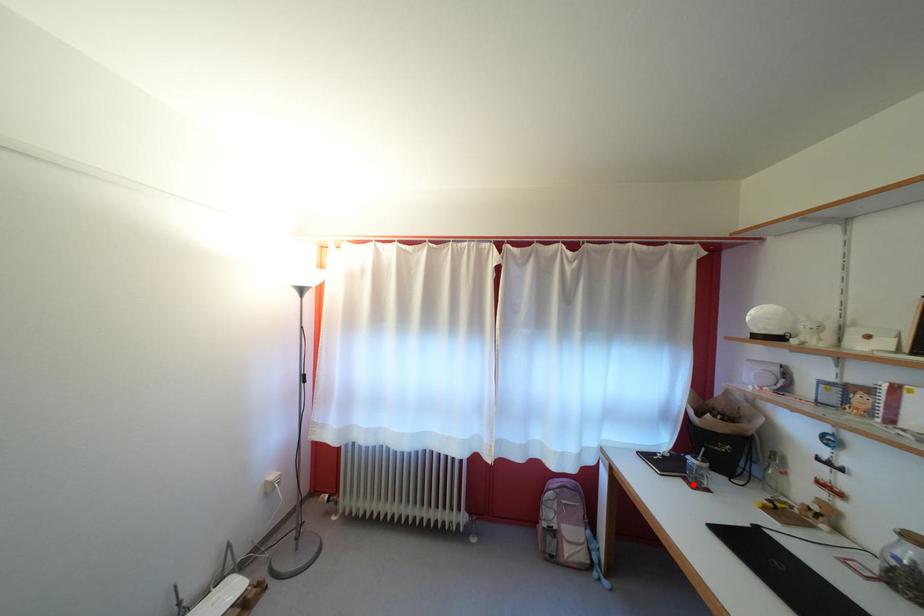
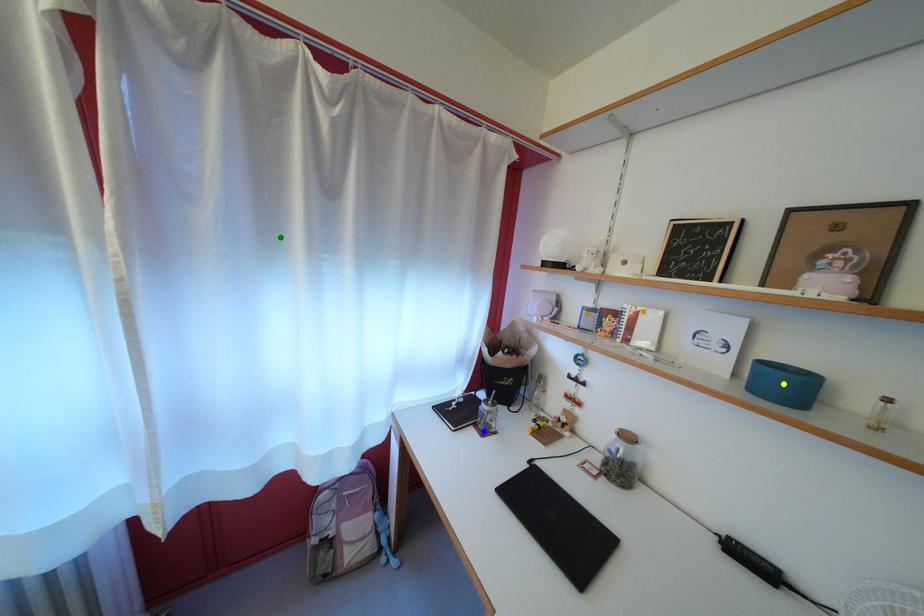
Question: I am providing you with two images of the same scene from different viewpoints. A red point is marked on the first image. You are given multiple points on the second image. Which spot in image 2 lines up with the point in image 1?

Choices:
 (A) blue point
 (B) green point
 (C) yellow point

Answer: (A)